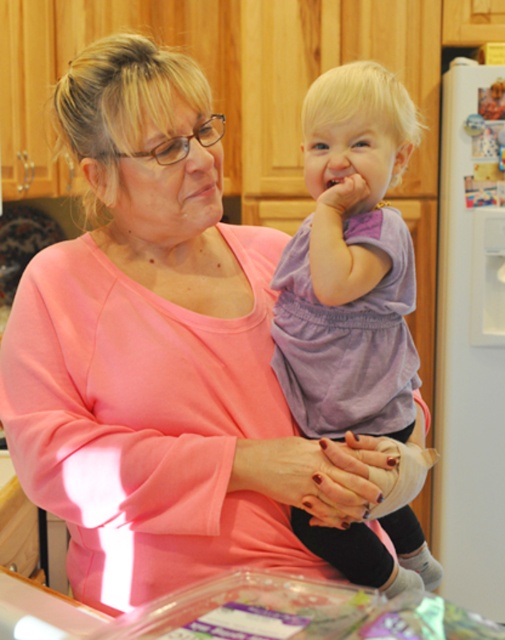
You are a fashion designer who wants to place a new accessory on the purple soft fabric dress at center. According to the image, where exactly should you place it?

The purple soft fabric dress at center is located at point (349, 262), so you should place the accessory there.

You are a photographer capturing a family moment. You notice the purple soft fabric dress at center and the nail polish painted fingernails at center. Which object is positioned higher in the image?

The purple soft fabric dress at center is located above the nail polish painted fingernails at center, so it is positioned higher in the image.